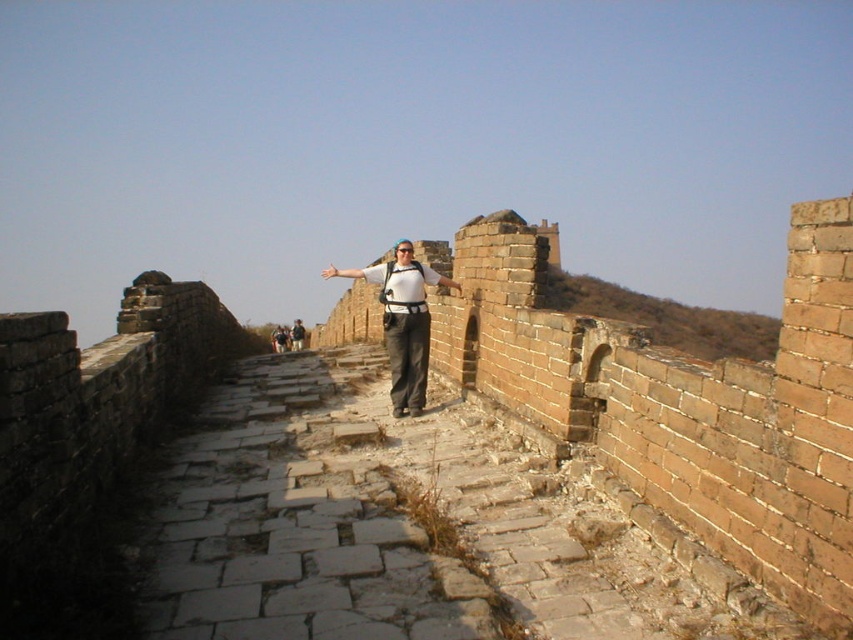
Looking at this image, you are a photographer taking a picture of the Great Wall. You notice the matte white shirt at center and the matte gray pants at center. Which clothing item is located to the right of the other?

The matte white shirt at center is positioned on the right side of matte gray pants at center.

You are a photographer trying to capture the matte white shirt at center on the Great Wall. The camera is positioned at the starting point of the wall. To ensure the shirt is in the center of your photo, where should you aim your camera? Use the coordinates provided in the description to determine the correct position.

The matte white shirt at center is located at coordinates point (402,321), so you should aim your camera directly at that point to ensure the shirt is centered in the photo.

You are a photographer planning to capture a silhouette of the person on the Great Wall. Since the sun is behind them, you need to ensure the person is positioned so their clothing items are clearly visible. Given the matte white shirt at center and the matte gray pants at center, which clothing item will appear larger in the silhouette?

The matte gray pants at center will appear larger in the silhouette because the matte white shirt at center occupies less space than the matte gray pants at center.